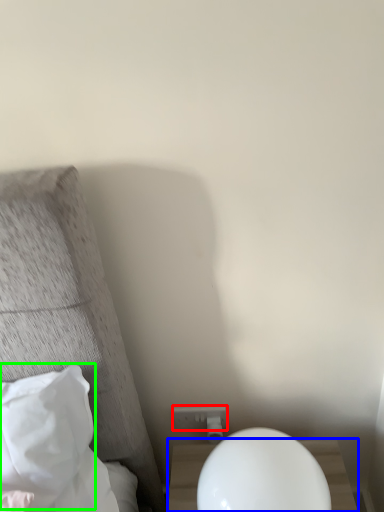
Question: Which is nearer to the electric outlet (highlighted by a red box)? nightstand (highlighted by a blue box) or pillow (highlighted by a green box).

Choices:
 (A) nightstand
 (B) pillow

Answer: (A)